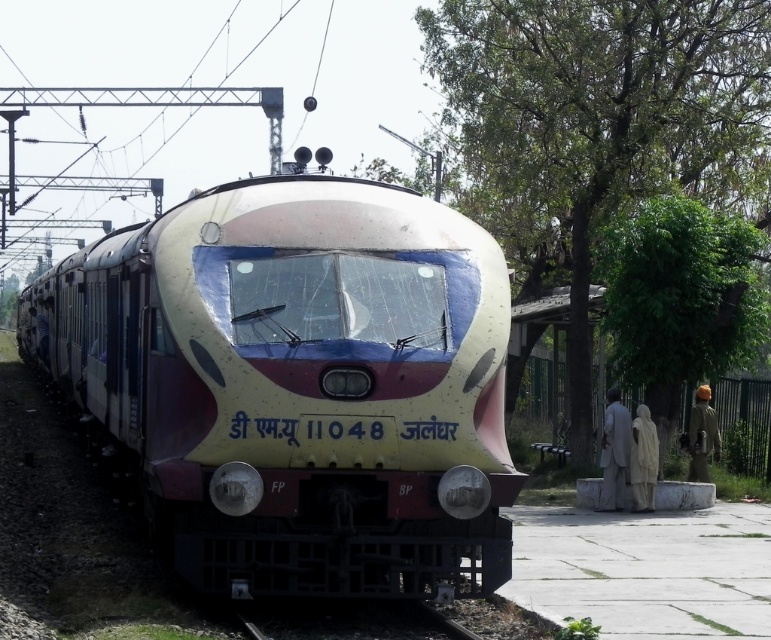
Question: Is white glossy train at center to the left of brown fabric turban at right from the viewer's perspective?

Choices:
 (A) yes
 (B) no

Answer: (A)

Question: Does white glossy train at center have a larger size compared to brown fabric turban at right?

Choices:
 (A) yes
 (B) no

Answer: (A)

Question: Does light gray fabric statue at right appear over white fabric at right?

Choices:
 (A) yes
 (B) no

Answer: (A)

Question: Among these objects, which one is farthest from the camera?

Choices:
 (A) light gray fabric statue at right
 (B) white fabric at right

Answer: (A)

Question: Which point appears farthest from the camera in this image?

Choices:
 (A) [706, 442]
 (B) [66, 282]
 (C) [630, 458]

Answer: (B)

Question: Which point is farther to the camera?

Choices:
 (A) (623, 422)
 (B) (655, 477)
 (C) (258, 413)

Answer: (A)